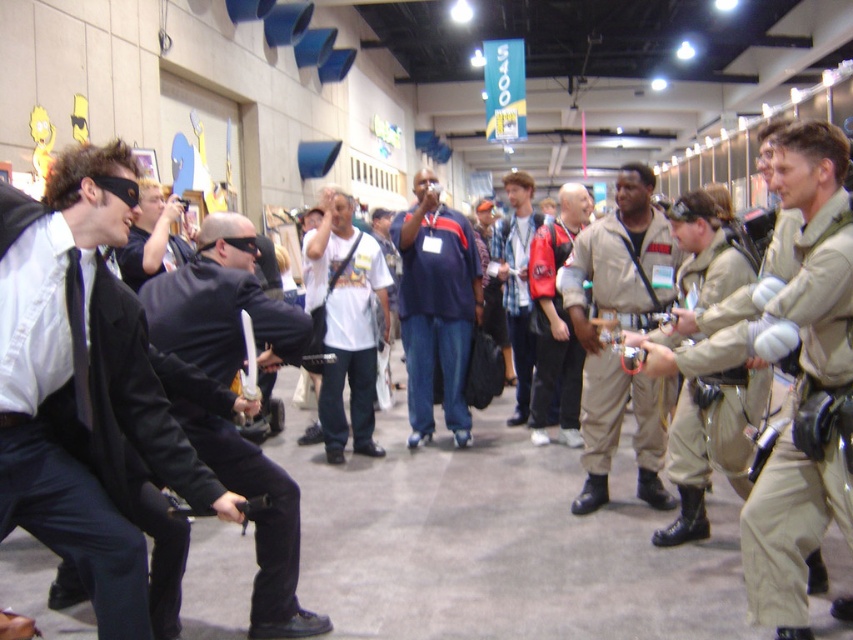
Question: Is matte black suit at left to the right of matte black camera at center from the viewer's perspective?

Choices:
 (A) yes
 (B) no

Answer: (A)

Question: Does khaki cotton jumpsuit at center appear over white cotton t-shirt at center?

Choices:
 (A) yes
 (B) no

Answer: (B)

Question: Which object is farther from the camera taking this photo?

Choices:
 (A) white cotton t-shirt at center
 (B) khaki cotton jumpsuit at center
 (C) dark blue jersey at center

Answer: (C)

Question: Which of the following is the farthest from the observer?

Choices:
 (A) matte black camera at center
 (B) dark blue jersey at center

Answer: (B)

Question: Is matte black suit at left positioned in front of white cotton t-shirt at center?

Choices:
 (A) no
 (B) yes

Answer: (B)

Question: Which point is closer to the camera taking this photo?

Choices:
 (A) (822, 349)
 (B) (20, 275)
 (C) (521, 212)

Answer: (B)